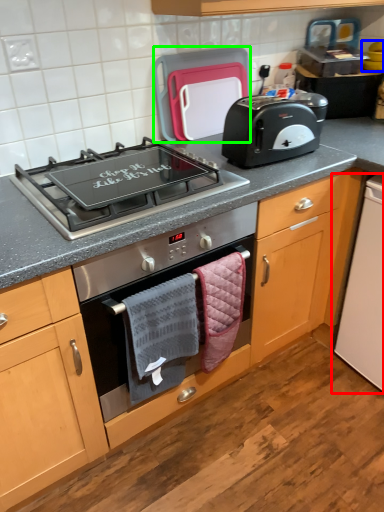
Question: Which object is positioned closest to appliance (highlighted by a red box)? Select from appliance (highlighted by a blue box) and kitchen appliance (highlighted by a green box).

Choices:
 (A) appliance
 (B) kitchen appliance

Answer: (B)